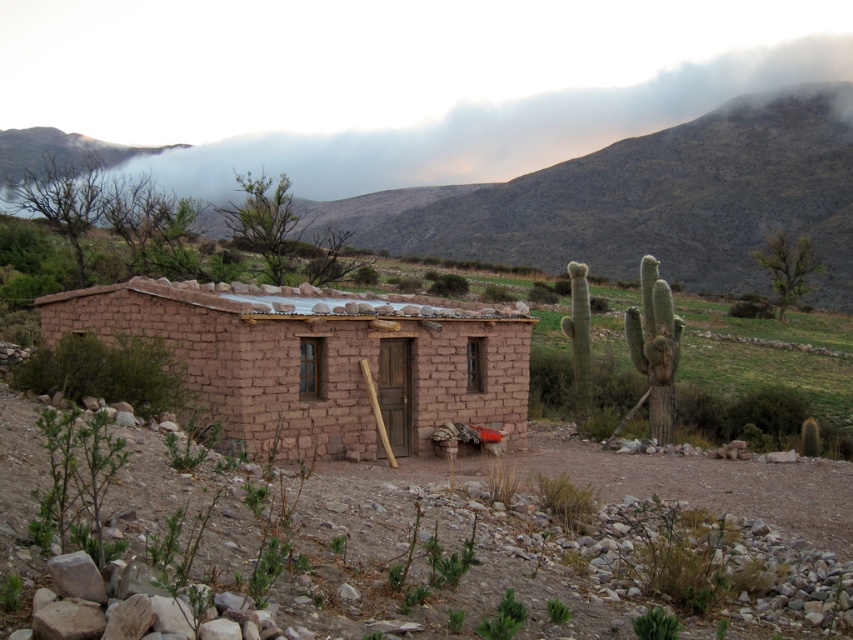
You are standing at the front of the rustic adobe house and notice two points marked in the scene. Which of the two points, point (256, 428) or point (0, 184), is closer to you?

Point (256, 428) is in front of point (0, 184), so it is closer to you.

You are standing at the origin point of the image, which is the bottom left corner. A brown adobe hut at center is marked by a point at coordinate (316, 364). If you want to walk directly towards the brown adobe hut at center, which direction should you move?

The point at coordinate (316, 364) marks the location of the brown adobe hut at center. Since the origin is the bottom left corner, moving towards the center would require heading northeast.